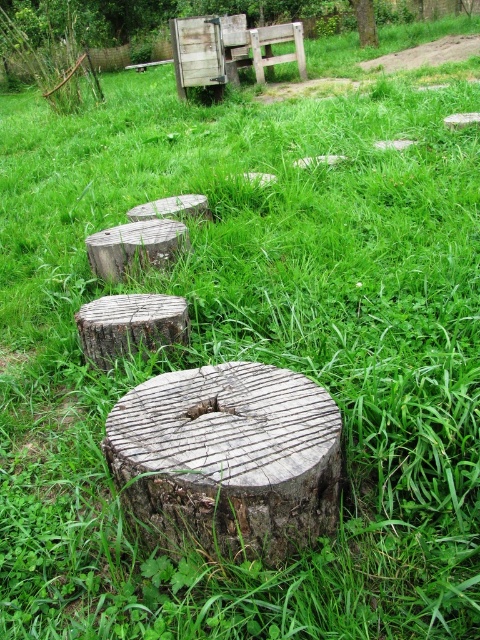
You are standing in a garden with circular tree stump stepping stones leading towards a wooden structure. You want to place a small decorative rock exactly at the point marked by the coordinates point (228, 458). Is this point located on the rough textured wood stump at center?

Yes, the rough textured wood stump at center is located at point (228, 458), so placing the small decorative rock there would place it directly on the stump.

You are a gardener planning to place a new decorative rock between the rough textured wood stump at center and the rough wooden stump at center. According to the scene description, where should you place the rock so it sits above both stumps?

The rough textured wood stump at center is positioned under the rough wooden stump at center. Therefore, placing the rock above the rough wooden stump at center would ensure it sits above both stumps.